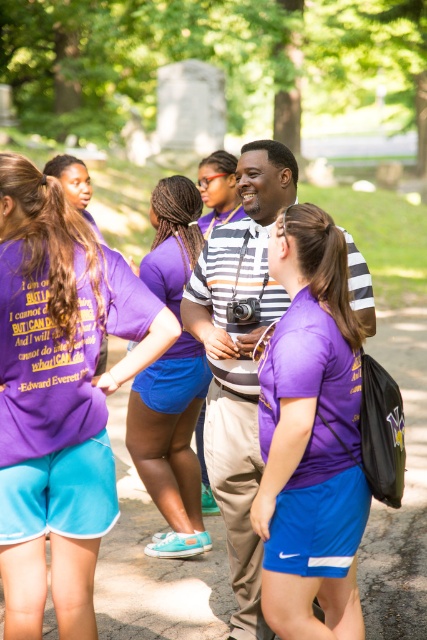
What is the location of the point with coordinates (61,323) in the image?

The point with coordinates (61,323) is located on the purple fabric shirt at left.

You are standing in the park and see a point marked at coordinates (227, 268). If you want to place a bench there, how far in meters should the bench be from your current position?

The point at (227, 268) is 4.08 meters away from the viewer, so the bench should be placed 4.08 meters away from your current position.

You are a photographer trying to capture a group photo of the purple fabric shirt at left and the matte purple shirt at center. If you want to ensure both shirts are fully visible in the frame, which shirt should you focus on to avoid cropping?

The purple fabric shirt at left has a larger width than the matte purple shirt at center, so you should focus on the purple fabric shirt at left to ensure it fits entirely in the frame without cropping.